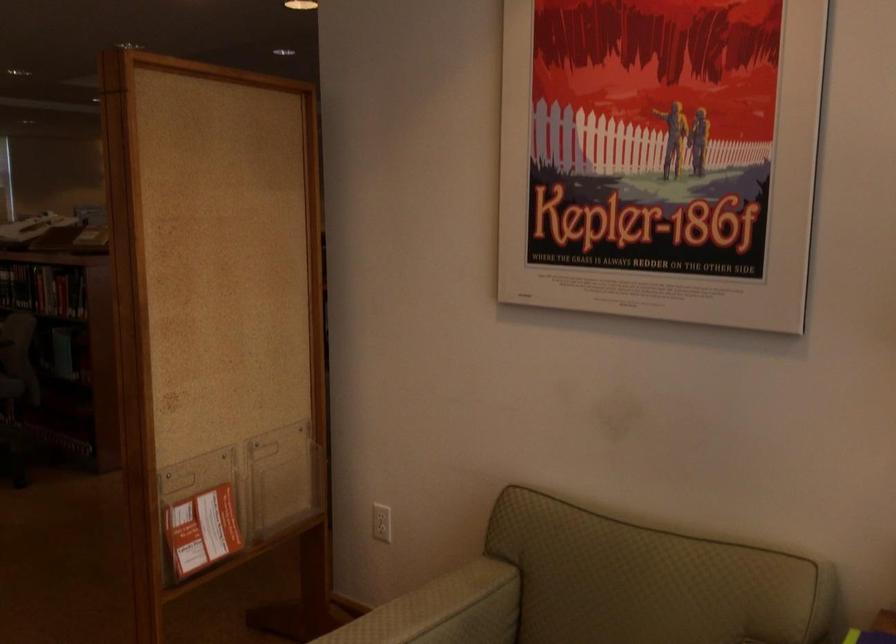
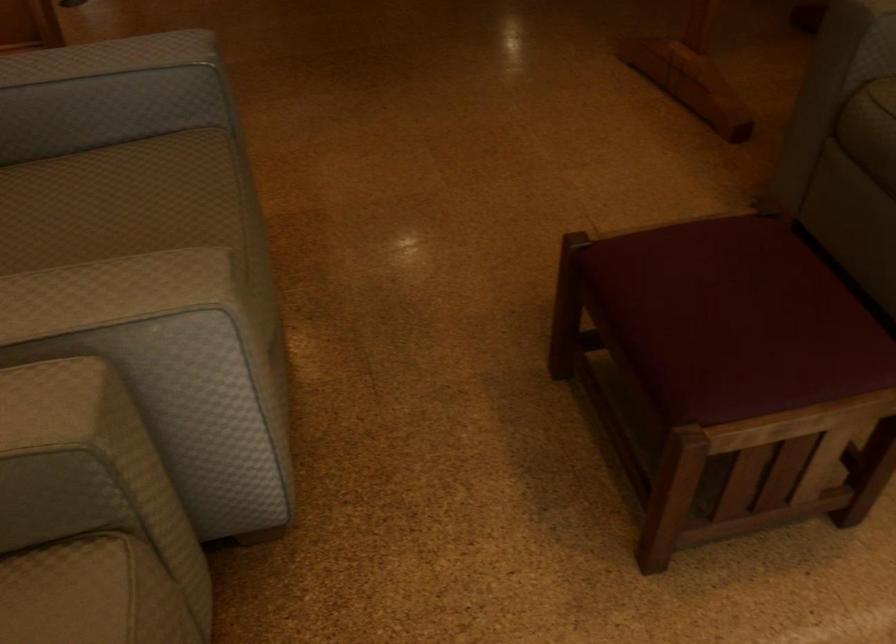
How did the camera likely rotate?

The rotation direction of the camera is left-down.